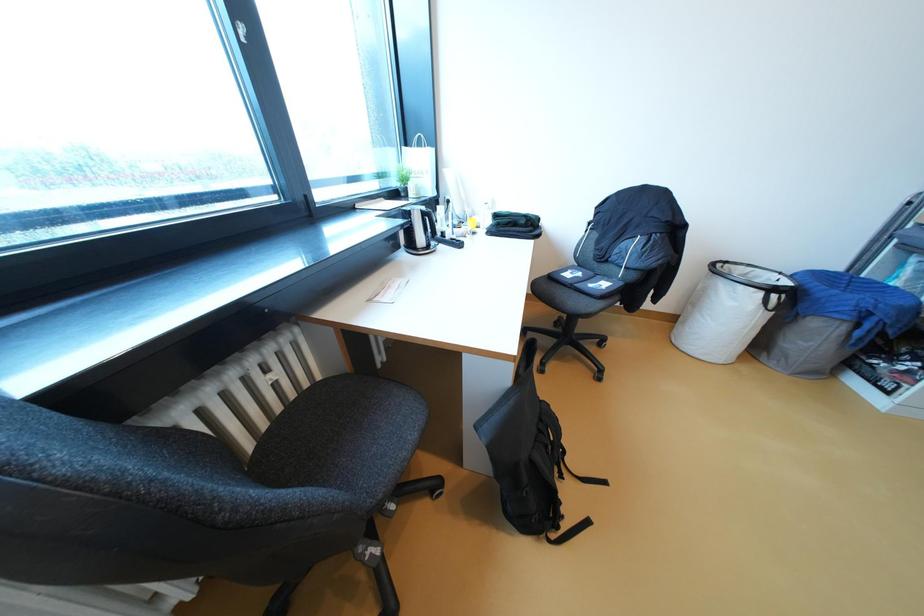
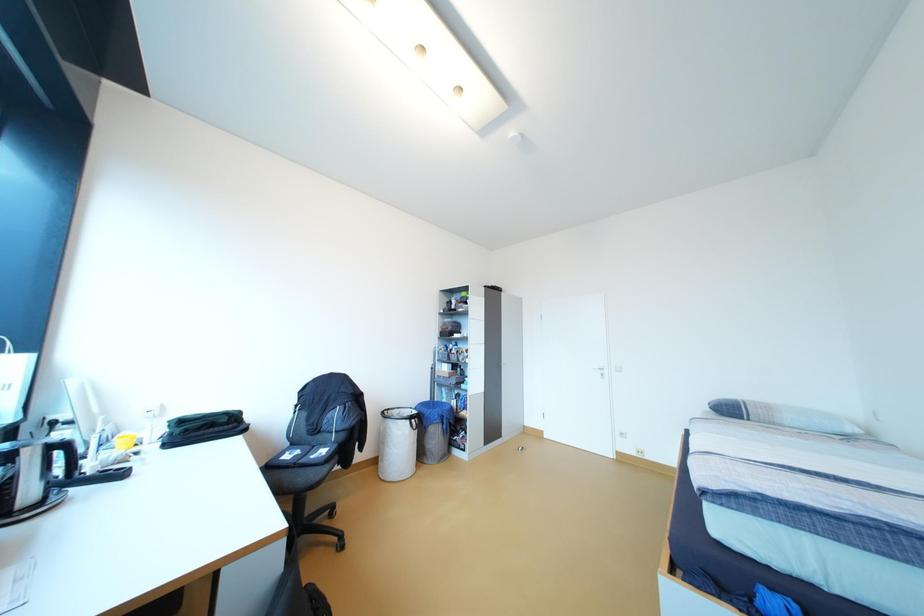
First-person continuous shooting, in which direction is the camera rotating?

The rotation direction of the camera is right-up.